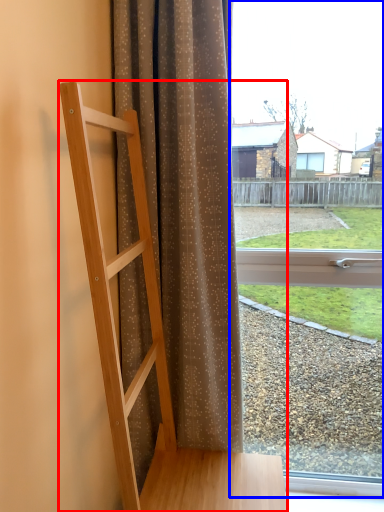
Question: Among these objects, which one is nearest to the camera, furniture (highlighted by a red box) or window (highlighted by a blue box)?

Choices:
 (A) furniture
 (B) window

Answer: (A)